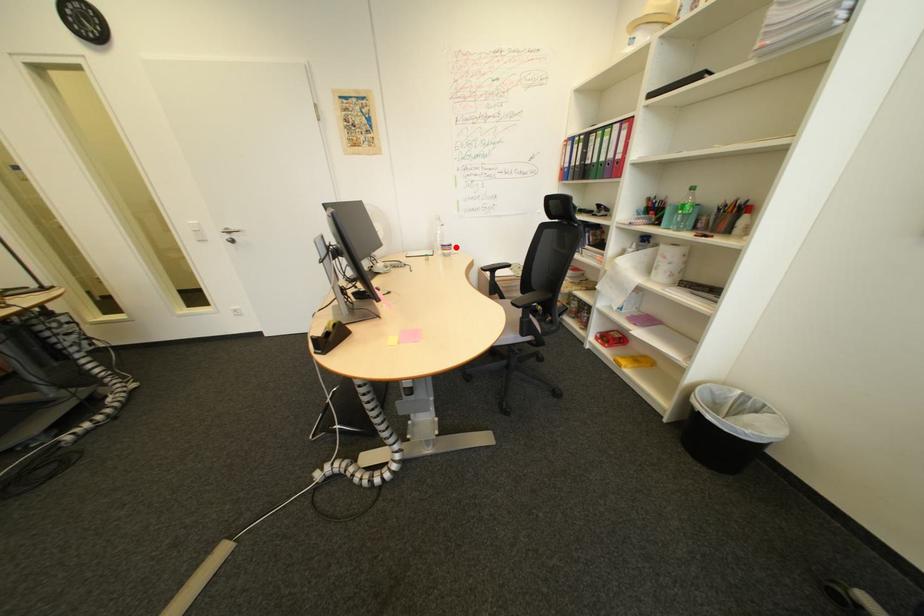
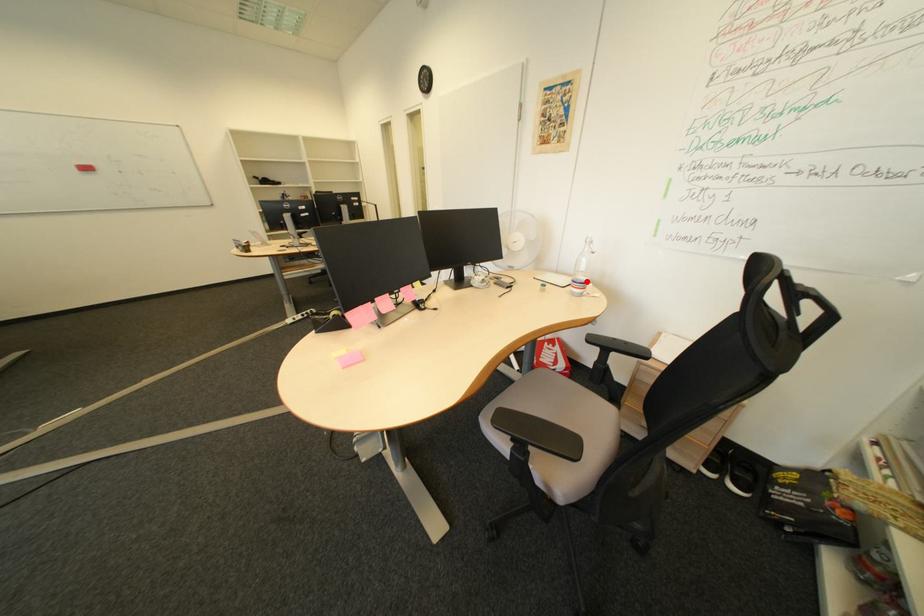
I am providing you with two images of the same scene from different viewpoints. A red point is marked on the first image and another point is marked on the second image. Is the red point in image1 aligned with the point shown in image2?

Yes